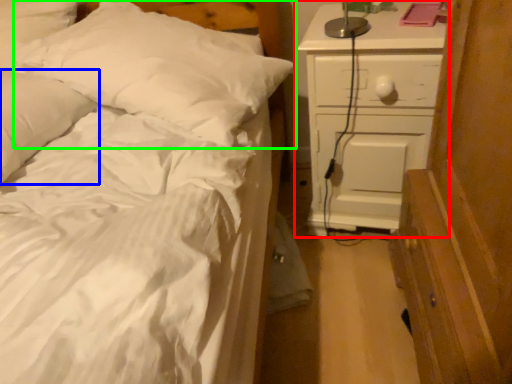
Question: Which object is positioned closest to chest of drawers (highlighted by a red box)? Select from pillow (highlighted by a blue box) and pillow (highlighted by a green box).

Choices:
 (A) pillow
 (B) pillow

Answer: (B)